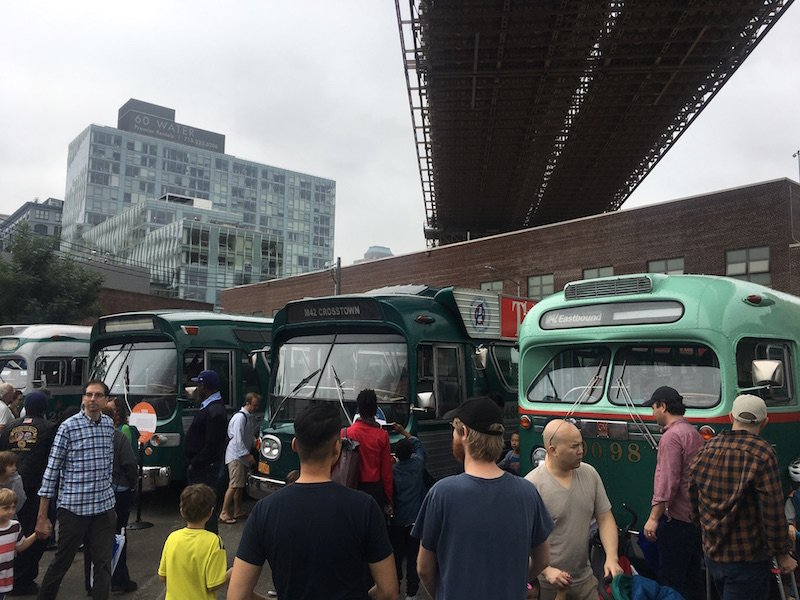
Locate an element on the screen. The width and height of the screenshot is (800, 600). lights is located at coordinates tap(590, 299).